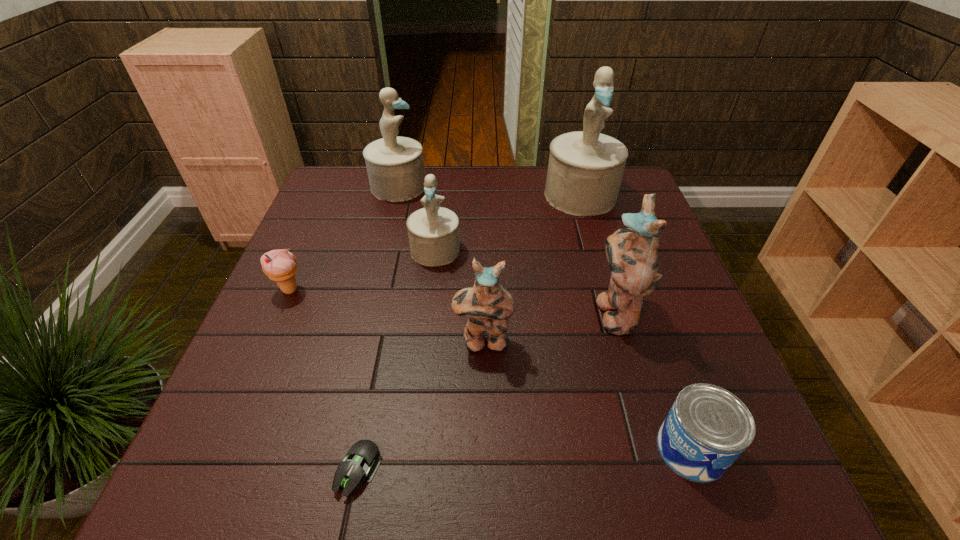
Find the location of a particular element. The height and width of the screenshot is (540, 960). blue can is located at coordinates (707, 428).

Where is `computer mouse`? computer mouse is located at coordinates (363, 459).

Where is `gray computer mouse`? gray computer mouse is located at coordinates (363, 459).

At what (x,y) coordinates should I click in order to perform the action: click on vacant region located 0.130m at the beak of the tallest object. Please return your answer as a coordinate pair (x, y). Image resolution: width=960 pixels, height=540 pixels. Looking at the image, I should click on (595, 246).

You are a GUI agent. You are given a task and a screenshot of the screen. Output one action in this format:
    pyautogui.click(x=<x>, y=<y>)
    Task: Click on the vacant area located at the beak of the second biggest white figurine
    
    Given the screenshot: What is the action you would take?
    pyautogui.click(x=484, y=186)

Where is `free space located 0.140m on the front-facing side of the right pink figurine`? This screenshot has width=960, height=540. free space located 0.140m on the front-facing side of the right pink figurine is located at coordinates (532, 312).

I want to click on vacant space positioned 0.300m on the front-facing side of the right pink figurine, so click(461, 312).

The height and width of the screenshot is (540, 960). I want to click on vacant area situated 0.300m on the front-facing side of the right pink figurine, so click(461, 312).

At what (x,y) coordinates should I click in order to perform the action: click on free space located at the beak of the third farthest object. Please return your answer as a coordinate pair (x, y). Looking at the image, I should click on (432, 281).

Where is `vacant position located 0.140m on the front-facing side of the smaller pink figurine`? The image size is (960, 540). vacant position located 0.140m on the front-facing side of the smaller pink figurine is located at coordinates (484, 418).